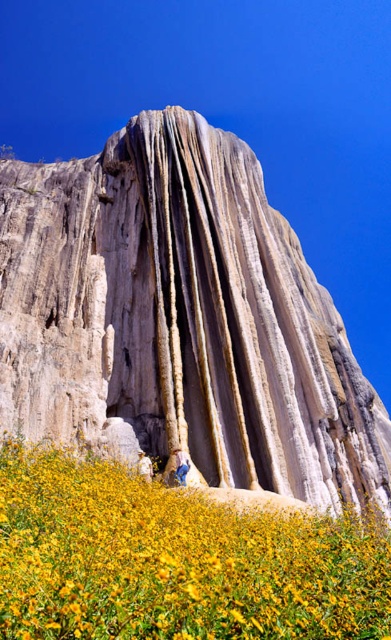
Question: Which object appears farthest from the camera in this image?

Choices:
 (A) yellow matte flower at lower center
 (B) white textured rock at center

Answer: (B)

Question: Which point is farther to the camera?

Choices:
 (A) pos(86,467)
 (B) pos(41,266)

Answer: (B)

Question: Can you confirm if white textured rock at center is positioned to the right of yellow matte flower at lower center?

Choices:
 (A) yes
 (B) no

Answer: (A)

Question: Is white textured rock at center thinner than yellow matte flower at lower center?

Choices:
 (A) no
 (B) yes

Answer: (A)

Question: Is the position of white textured rock at center more distant than that of yellow matte flower at lower center?

Choices:
 (A) yes
 (B) no

Answer: (A)